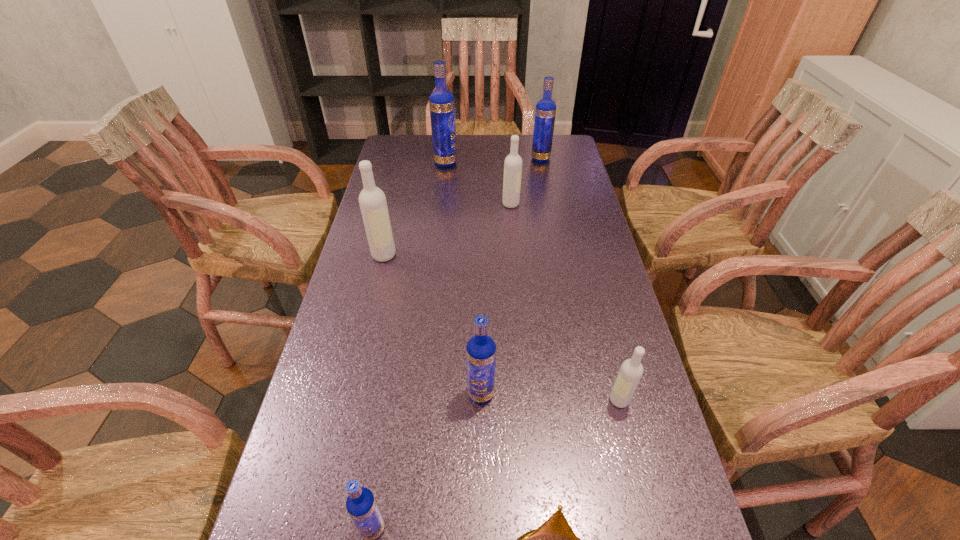
In the image, there is a desktop. What are the coordinates of `vacant space at the far edge` in the screenshot? It's located at (458, 162).

Identify the location of vacant space at the left edge of the desktop. (327, 530).

The image size is (960, 540). I want to click on free space at the right edge of the desktop, so click(x=611, y=352).

Where is `free space at the far left corner`? This screenshot has height=540, width=960. free space at the far left corner is located at coordinates pos(416,140).

Where is `unoccupied area between the nearest white vodka and the third blue vodka from left to right`? This screenshot has height=540, width=960. unoccupied area between the nearest white vodka and the third blue vodka from left to right is located at coordinates (550, 397).

In order to click on vacant space that is in between the second nearest blue vodka and the tallest object in this screenshot , I will do `click(464, 278)`.

Locate an element on the screen. This screenshot has width=960, height=540. vacant point located between the second blue vodka from right to left and the fourth farthest object is located at coordinates (432, 324).

Where is `free point between the second farthest white vodka and the second smallest white vodka`? free point between the second farthest white vodka and the second smallest white vodka is located at coordinates (447, 230).

At what (x,y) coordinates should I click in order to perform the action: click on object that stands as the sixth closest to the farthest white vodka. Please return your answer as a coordinate pair (x, y). The height and width of the screenshot is (540, 960). Looking at the image, I should click on (554, 539).

Identify the location of object that stands as the third closest to the biggest blue vodka. The width and height of the screenshot is (960, 540). (372, 200).